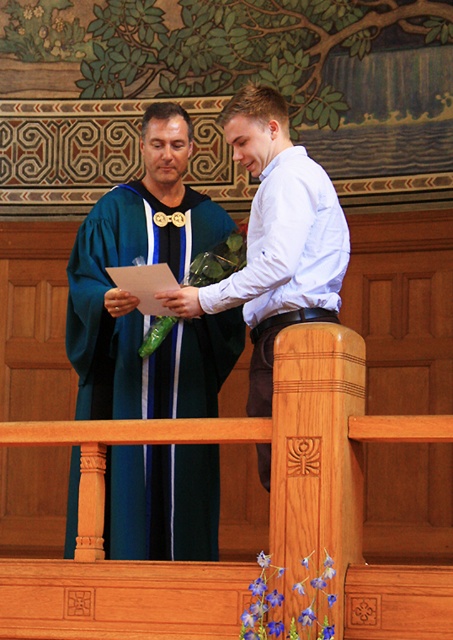
Question: Does teal satin gown at center have a greater width compared to matte green robe at center?

Choices:
 (A) yes
 (B) no

Answer: (A)

Question: Does teal satin gown at center appear under matte green robe at center?

Choices:
 (A) no
 (B) yes

Answer: (B)

Question: Which object is farther from the camera taking this photo?

Choices:
 (A) matte green robe at center
 (B) teal satin gown at center

Answer: (B)

Question: Among these objects, which one is farthest from the camera?

Choices:
 (A) matte green robe at center
 (B) teal satin gown at center

Answer: (B)

Question: Is teal satin gown at center bigger than matte green robe at center?

Choices:
 (A) no
 (B) yes

Answer: (A)